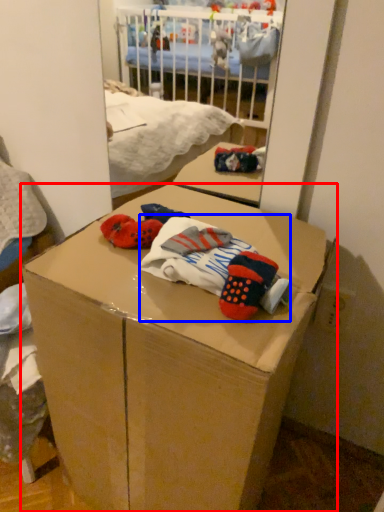
Question: Among these objects, which one is nearest to the camera, box (highlighted by a red box) or baby clothe (highlighted by a blue box)?

Choices:
 (A) box
 (B) baby clothe

Answer: (A)